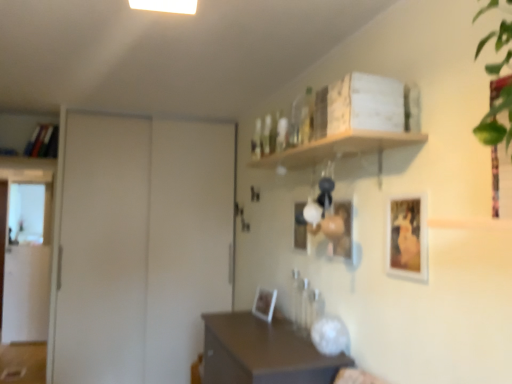
Question: Relative to translucent glass bottle at upper center, is matte white picture frame at center, the 1th picture frame from the back, in front or behind?

Choices:
 (A) behind
 (B) front

Answer: (A)

Question: In terms of width, does matte white picture frame at center, which ranks as the fourth picture frame in front-to-back order, look wider or thinner when compared to translucent glass bottle at upper center?

Choices:
 (A) wide
 (B) thin

Answer: (A)

Question: Which is nearer to the matte wooden picture frame at center, which is the 3th picture frame in left-to-right order?

Choices:
 (A) brown matte table at center
 (B) translucent glass bottle at upper center
 (C) white matte door at left
 (D) wooden shelf at upper center
 (E) matte black picture frame at center, placed as the third picture frame when sorted from right to left

Answer: (D)

Question: Which object is positioned farthest from the matte wooden picture frame at center, which is the 3th picture frame in left-to-right order?

Choices:
 (A) brown matte table at center
 (B) matte white picture frame at center, which ranks as the fourth picture frame in front-to-back order
 (C) matte black picture frame at center, acting as the 3th picture frame starting from the front
 (D) translucent glass bottle at upper center
 (E) white matte door at left

Answer: (E)